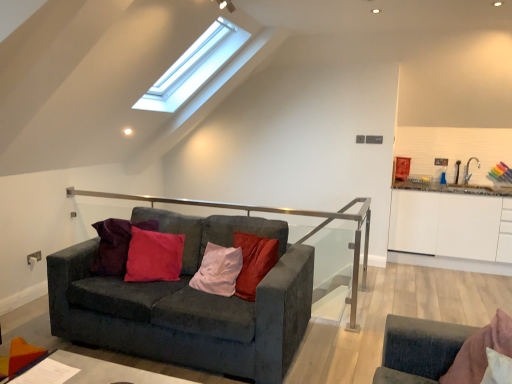
Question: From their relative heights in the image, would you say white glossy cabinet at right is taller or shorter than velvet dark gray couch at center?

Choices:
 (A) tall
 (B) short

Answer: (A)

Question: Do you think white glossy cabinet at right is within velvet dark gray couch at center, or outside of it?

Choices:
 (A) inside
 (B) outside

Answer: (B)

Question: Estimate the real-world distances between objects in this image. Which object is closer to the smooth gray table at lower left?

Choices:
 (A) velvet dark gray couch at center
 (B) white glossy cabinet at right

Answer: (A)

Question: Which object is positioned closest to the smooth gray table at lower left?

Choices:
 (A) white glossy cabinet at right
 (B) velvet dark gray couch at center

Answer: (B)